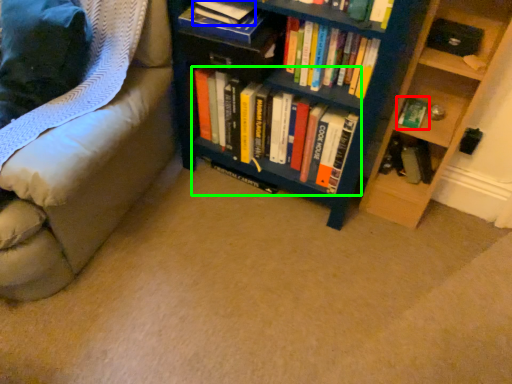
Question: Considering the real-world distances, which object is closest to book (highlighted by a red box)? book (highlighted by a blue box) or book (highlighted by a green box).

Choices:
 (A) book
 (B) book

Answer: (B)